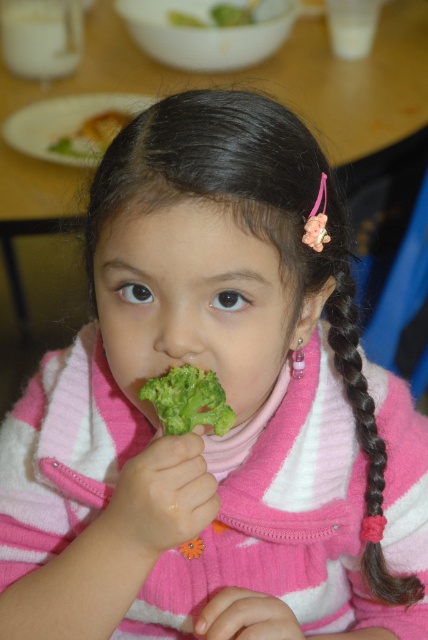
The girl in the image is holding a broccoli close to her mouth. If you were to draw a point at coordinates (x=189, y=401) on the image, which object would that point be closest to?

The point at coordinates (x=189, y=401) corresponds to the green matte broccoli at mouth.

You are a nutritionist trying to assess the girl in the image. You need to determine if the broccoli she is holding near her mouth is part of the broccoli on the table. Based on the distance between the green matte broccoli at mouth and the green broccoli at center, can you confirm if they are the same broccoli?

The distance between the green matte broccoli at mouth and the green broccoli at center is 1.07 meters, so they are not the same broccoli since the distance is too large for them to be connected.

The girl is holding the green matte broccoli at mouth and there is another green broccoli at center on the table. Which one takes up more space?

The green broccoli at center takes up more space than the green matte broccoli at mouth.